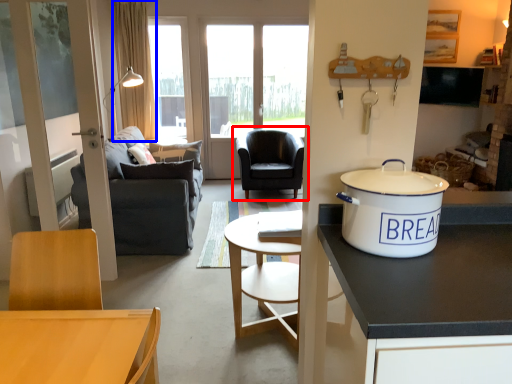
Question: Which object is further to the camera taking this photo, chair (highlighted by a red box) or curtain (highlighted by a blue box)?

Choices:
 (A) chair
 (B) curtain

Answer: (B)